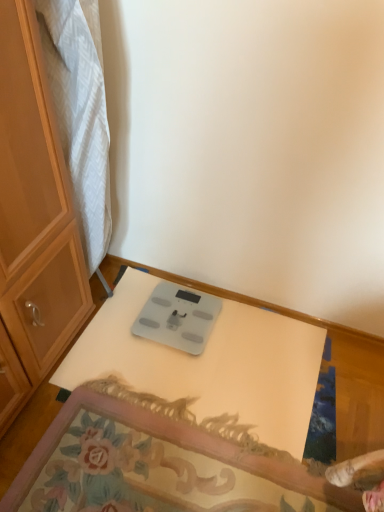
Question: Based on their positions, is matte wood cabinet at left located to the left or right of silver metallic scale at center?

Choices:
 (A) left
 (B) right

Answer: (A)

Question: Is matte wood cabinet at left in front of or behind silver metallic scale at center in the image?

Choices:
 (A) front
 (B) behind

Answer: (A)

Question: Based on their relative distances, which object is farther from the silver metallic scale at center?

Choices:
 (A) matte wood cabinet at left
 (B) white glossy table at center

Answer: (A)

Question: Which object is positioned farthest from the silver metallic scale at center?

Choices:
 (A) white glossy table at center
 (B) matte wood cabinet at left

Answer: (B)